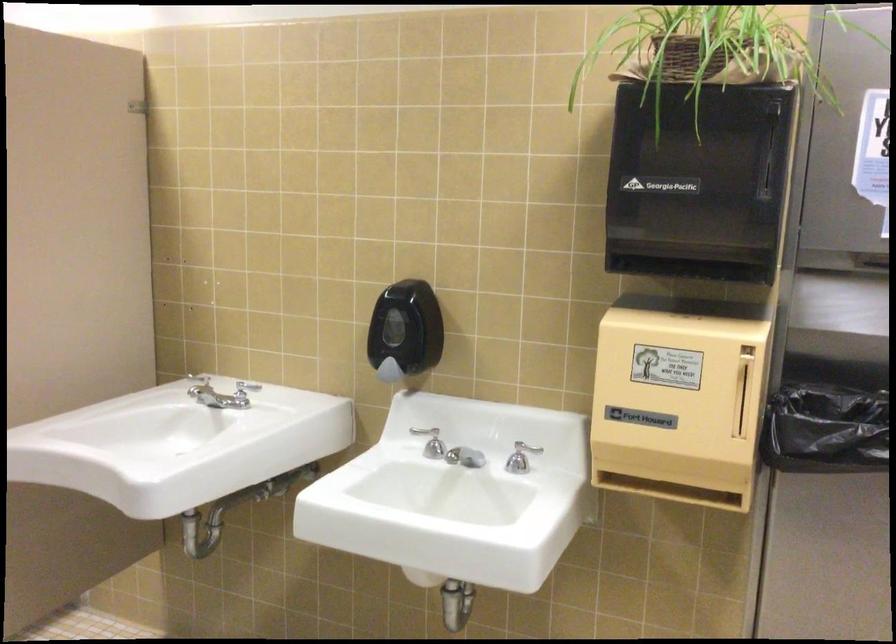
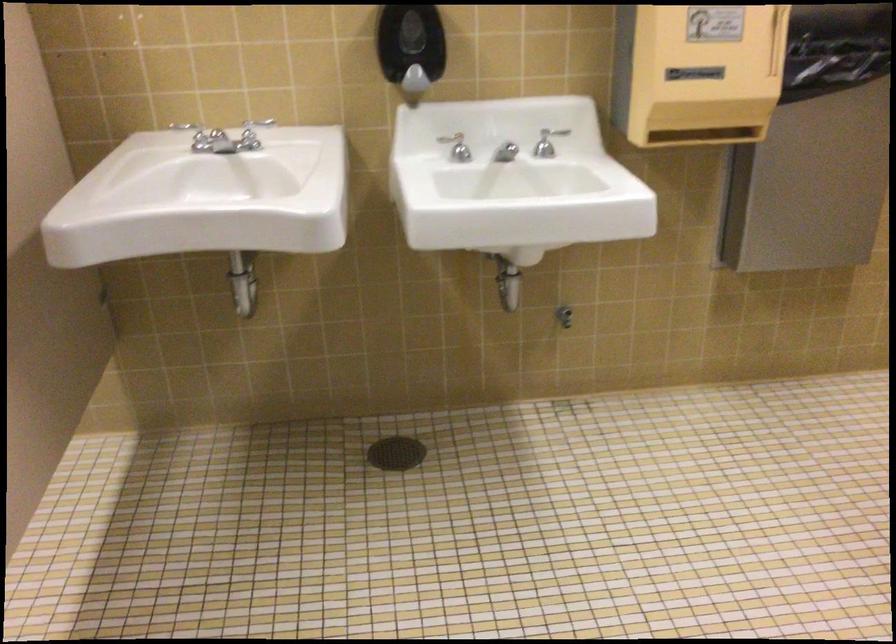
In the second image, find the point that corresponds to pixel 526 453 in the first image.

(547, 142)